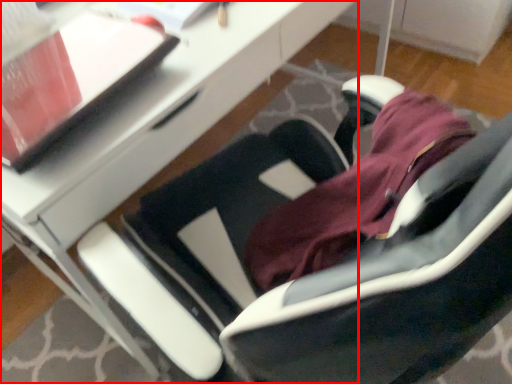
Question: From the image, what is the correct spatial relationship of desk (annotated by the red box) in relation to notepad?

Choices:
 (A) right
 (B) left

Answer: (A)